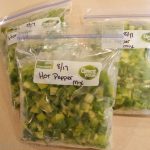
Identify the location of corner. The image size is (150, 150). (22, 140).